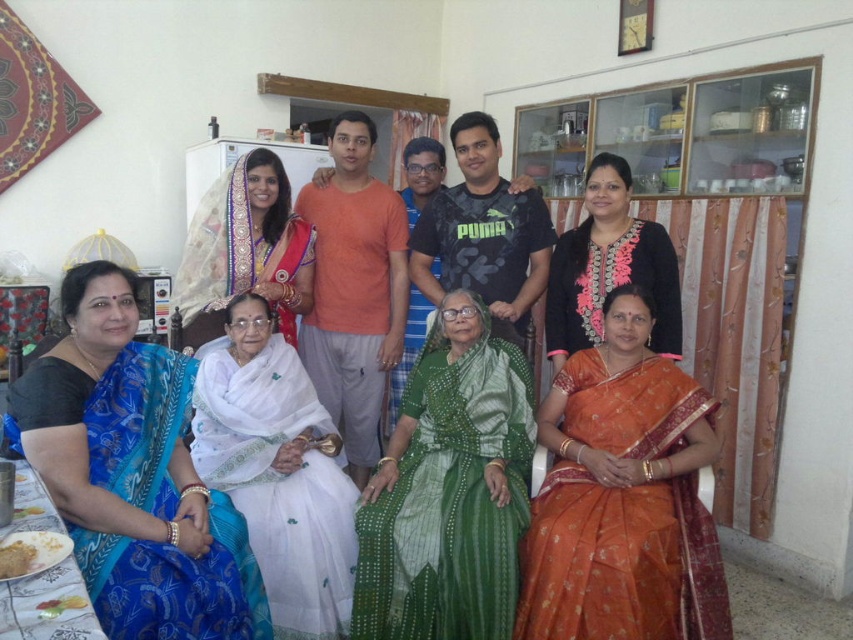
Which of these two, green silk saree at center or black silk saree at upper center, stands taller?

Standing taller between the two is green silk saree at center.

Who is positioned more to the left, green silk saree at center or black silk saree at upper center?

From the viewer's perspective, green silk saree at center appears more on the left side.

What do you see at coordinates (450, 490) in the screenshot?
I see `green silk saree at center` at bounding box center [450, 490].

Image resolution: width=853 pixels, height=640 pixels. I want to click on green silk saree at center, so click(450, 490).

Is silky blue sari at lower left smaller than white silk saree at center?

Incorrect, silky blue sari at lower left is not smaller in size than white silk saree at center.

Can you confirm if silky blue sari at lower left is positioned below white silk saree at center?

Actually, silky blue sari at lower left is above white silk saree at center.

Between point (628, 554) and point (302, 436), which one is positioned behind?

Point (302, 436)

The height and width of the screenshot is (640, 853). What are the coordinates of `silky blue sari at lower left` in the screenshot? It's located at (611, 545).

Who is higher up, blue silk saree at lower left or black silk saree at upper center?

Positioned higher is black silk saree at upper center.

Does blue silk saree at lower left have a greater width compared to black silk saree at upper center?

Yes.

Find the location of a particular element. This screenshot has height=640, width=853. blue silk saree at lower left is located at coordinates (132, 474).

Locate an element on the screen. blue silk saree at lower left is located at coordinates (132, 474).